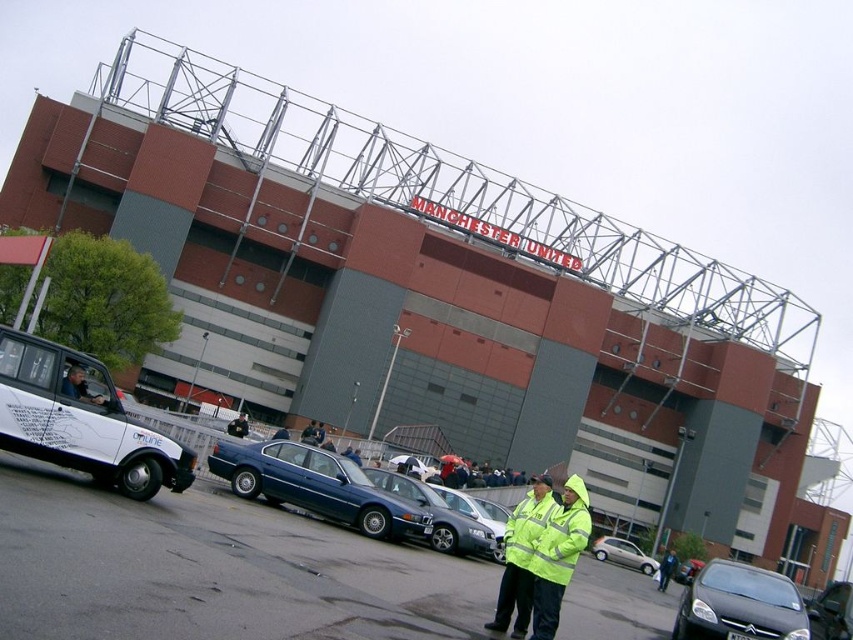
Question: Among these objects, which one is nearest to the camera?

Choices:
 (A) yellow reflective jacket at center
 (B) dark blue car at center
 (C) shiny black car at lower right

Answer: (B)

Question: Is yellow reflective jacket at center to the left of metallic silver sedan at center from the viewer's perspective?

Choices:
 (A) yes
 (B) no

Answer: (B)

Question: Among these objects, which one is nearest to the camera?

Choices:
 (A) metallic silver sedan at center
 (B) reflective yellow jacket at center
 (C) yellow reflective jacket at center

Answer: (B)

Question: Does dark blue car at center come in front of reflective yellow jacket at center?

Choices:
 (A) no
 (B) yes

Answer: (B)

Question: Which of the following is the closest to the observer?

Choices:
 (A) silver metallic sedan at center
 (B) matte black jacket at center

Answer: (B)

Question: Does reflective yellow jacket at center have a smaller size compared to high-visibility yellow reflective safety vest at center?

Choices:
 (A) no
 (B) yes

Answer: (A)